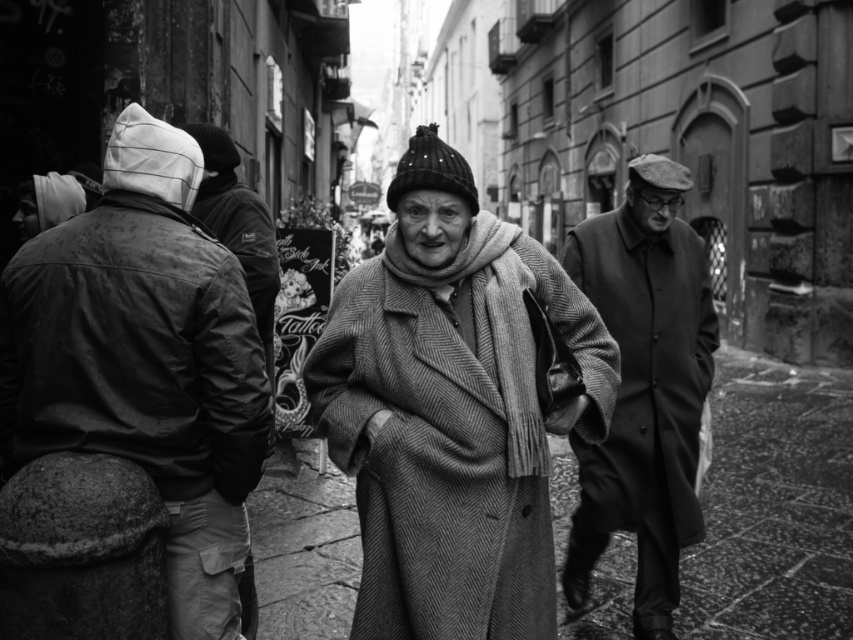
You are a photographer trying to capture a group photo of the leather jacket at left and the coarse wool coat at right. Since you want them both in the frame, which direction should you move the camera to ensure both are visible?

The leather jacket at left is positioned on the left side of coarse wool coat at right, so moving the camera to the right would ensure both are visible.

You are a fashion designer observing the elderly woman in the image. You need to determine if her herringbone wool coat at center can accommodate her coarse wool scarf at center. Based on their sizes, can the scarf fit inside the coat?

The herringbone wool coat at center has a larger size compared to coarse wool scarf at center, so yes, the coarse wool scarf at center can fit inside the herringbone wool coat at center.